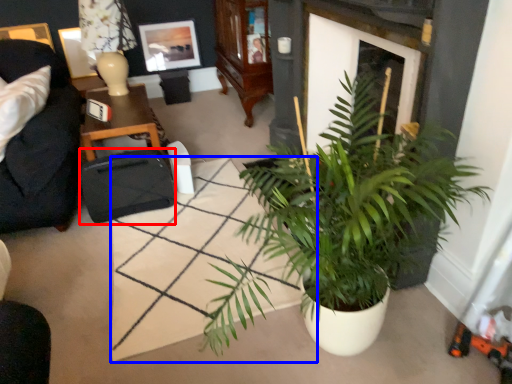
Question: Among these objects, which one is farthest to the camera, luggage and bags (highlighted by a red box) or square (highlighted by a blue box)?

Choices:
 (A) luggage and bags
 (B) square

Answer: (A)